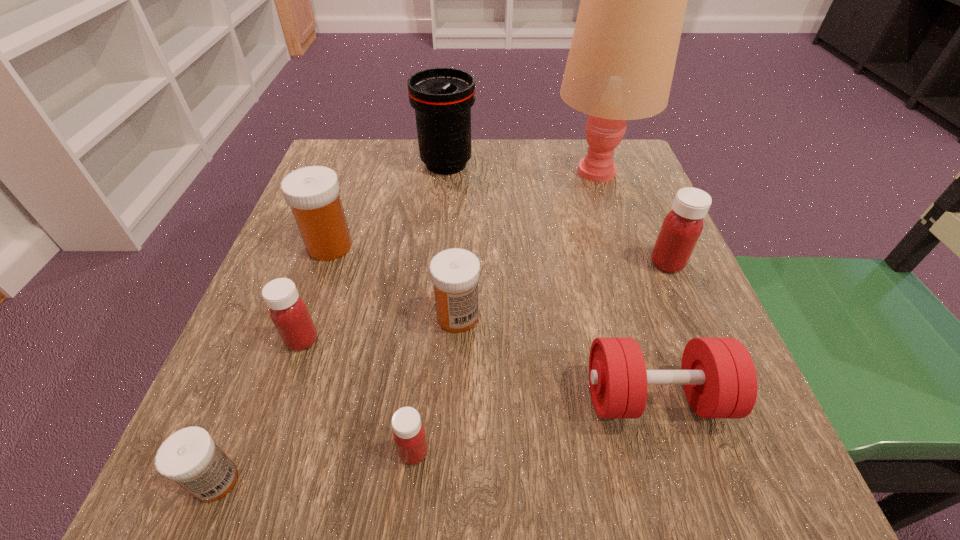
I want to click on free space located 0.180m on the back of the leftmost red medicine, so click(x=332, y=252).

Locate an element on the screen. This screenshot has width=960, height=540. free space located on the back of the dumbbell is located at coordinates (603, 226).

This screenshot has width=960, height=540. In order to click on vacant space located 0.280m on the left of the smallest red medicine in this screenshot , I will do `click(184, 452)`.

This screenshot has height=540, width=960. I want to click on vacant space located on the back of the nearest white medicine, so coord(260,372).

At what (x,y) coordinates should I click in order to perform the action: click on lampshade at the far edge. Please return your answer as a coordinate pair (x, y). The height and width of the screenshot is (540, 960). Looking at the image, I should click on (620, 66).

The width and height of the screenshot is (960, 540). In order to click on telephoto lens that is at the far edge in this screenshot , I will do `click(442, 98)`.

Locate an element on the screen. lampshade positioned at the right edge is located at coordinates (620, 66).

Locate an element on the screen. This screenshot has width=960, height=540. medicine positioned at the right edge is located at coordinates (681, 228).

Locate an element on the screen. This screenshot has width=960, height=540. dumbbell that is positioned at the right edge is located at coordinates (718, 375).

Find the location of a particular element. object at the near left corner is located at coordinates (190, 457).